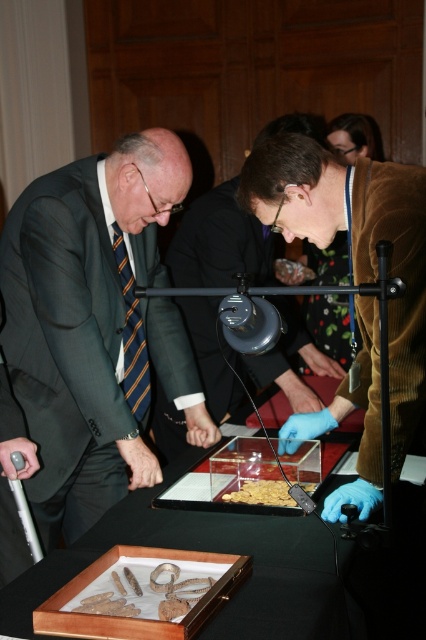
Question: Which of the following is the farthest from the observer?

Choices:
 (A) striped fabric tie at left
 (B) blue latex gloves at center

Answer: (A)

Question: Is transparent glass tray at center to the right of matte black suit at center from the viewer's perspective?

Choices:
 (A) yes
 (B) no

Answer: (B)

Question: Is striped fabric tie at left below translucent plastic food at center?

Choices:
 (A) yes
 (B) no

Answer: (B)

Question: Based on their relative distances, which object is farther from the matte black suit at center?

Choices:
 (A) translucent plastic food at center
 (B) matte black suit at left
 (C) transparent glass tray at center

Answer: (A)

Question: Is matte black suit at left thinner than transparent glass tray at center?

Choices:
 (A) no
 (B) yes

Answer: (B)

Question: Which is nearer to the transparent glass tray at center?

Choices:
 (A) striped fabric tie at left
 (B) translucent plastic food at center
 (C) matte black suit at center

Answer: (B)